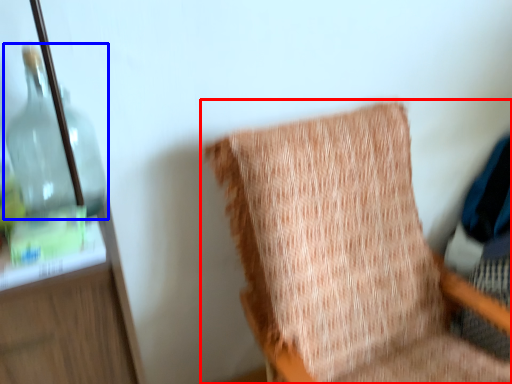
Question: Among these objects, which one is nearest to the camera, chair (highlighted by a red box) or bottle (highlighted by a blue box)?

Choices:
 (A) chair
 (B) bottle

Answer: (A)